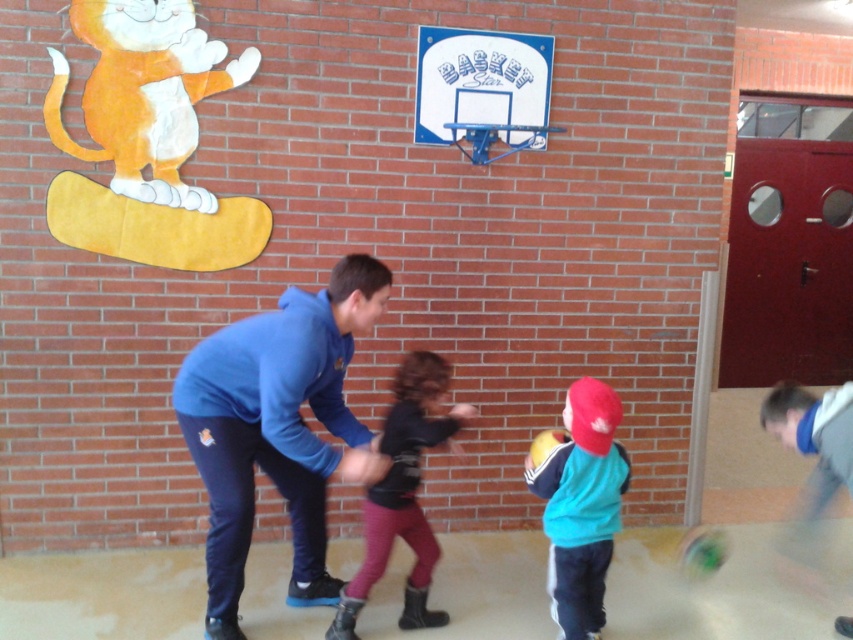
Question: Which point is farther to the camera?

Choices:
 (A) (410, 573)
 (B) (440, 74)
 (C) (235, 548)

Answer: (B)

Question: Does teal matte jacket at center have a greater width compared to velvet black jacket at center?

Choices:
 (A) no
 (B) yes

Answer: (A)

Question: Does blue fleece jacket at center have a greater width compared to white plastic basketball hoop at upper center?

Choices:
 (A) no
 (B) yes

Answer: (B)

Question: Is blue fleece jacket at center thinner than velvet black jacket at center?

Choices:
 (A) no
 (B) yes

Answer: (A)

Question: Among these points, which one is nearest to the camera?

Choices:
 (A) (577, 476)
 (B) (453, 36)
 (C) (405, 509)
 (D) (227, 364)

Answer: (D)

Question: Which object is farther from the camera taking this photo?

Choices:
 (A) blue fleece jacket at center
 (B) teal matte jacket at center

Answer: (B)